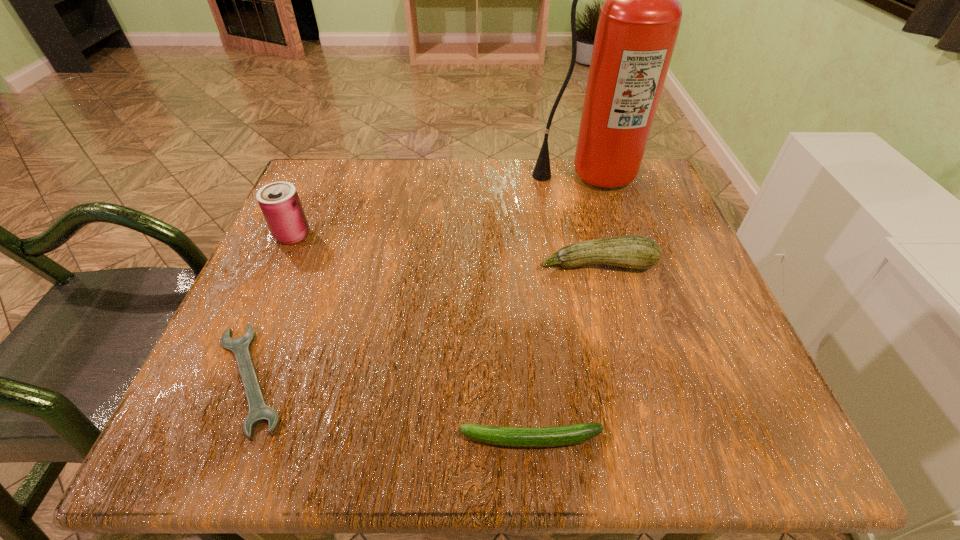
In the image, there is a desktop. At what (x,y) coordinates should I click in order to perform the action: click on blank space at the near right corner. Please return your answer as a coordinate pair (x, y). The height and width of the screenshot is (540, 960). Looking at the image, I should click on (692, 412).

Find the location of a particular element. vacant area that lies between the third tallest object and the second shortest object is located at coordinates (564, 352).

The image size is (960, 540). In order to click on free space between the farther zucchini and the farthest object in this screenshot , I will do `click(592, 220)`.

In order to click on vacant space that is in between the shorter zucchini and the shortest object in this screenshot , I will do `click(391, 409)`.

You are a GUI agent. You are given a task and a screenshot of the screen. Output one action in this format:
    pyautogui.click(x=<x>, y=<y>)
    Task: Click on the free space between the taller zucchini and the fourth tallest object
    The height and width of the screenshot is (540, 960).
    Given the screenshot: What is the action you would take?
    pyautogui.click(x=564, y=352)

Identify the location of blank region between the shorter zucchini and the can. (412, 337).

At what (x,y) coordinates should I click in order to perform the action: click on vacant area that lies between the farthest object and the farther zucchini. Please return your answer as a coordinate pair (x, y). Looking at the image, I should click on (592, 220).

Image resolution: width=960 pixels, height=540 pixels. Identify the location of empty location between the shortest object and the nearer zucchini. (391, 409).

I want to click on vacant region between the farthest object and the shortest object, so click(x=419, y=277).

Locate an element on the screen. The image size is (960, 540). free space between the tallest object and the shortest object is located at coordinates (419, 277).